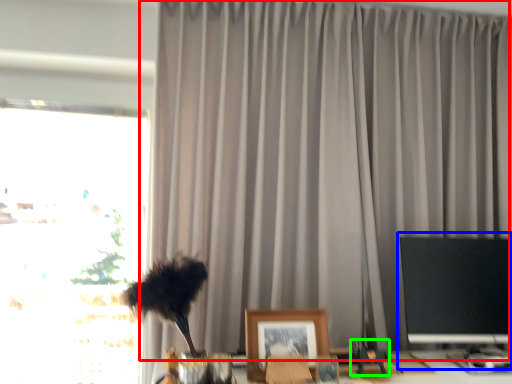
Question: Which object is positioned closest to curtain (highlighted by a red box)? Select from computer monitor (highlighted by a blue box) and toy (highlighted by a green box).

Choices:
 (A) computer monitor
 (B) toy

Answer: (A)